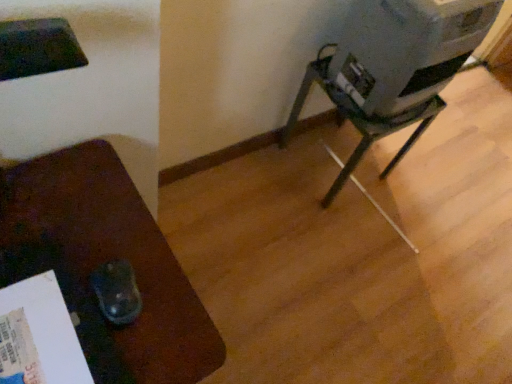
Where is `free spot to the right of metallic gray projector at center-right, the 2th furniture in the left-to-right sequence`? Image resolution: width=512 pixels, height=384 pixels. free spot to the right of metallic gray projector at center-right, the 2th furniture in the left-to-right sequence is located at coordinates (410, 196).